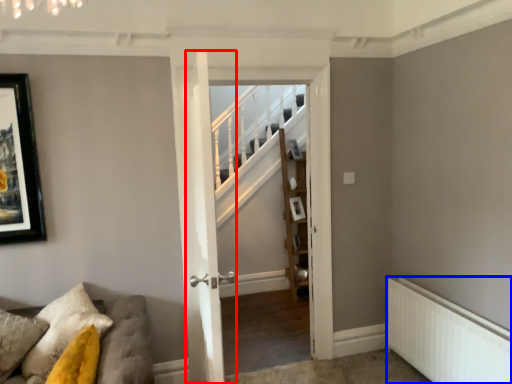
Question: Which point is closer to the camera, door (highlighted by a red box) or radiator (highlighted by a blue box)?

Choices:
 (A) door
 (B) radiator

Answer: (A)